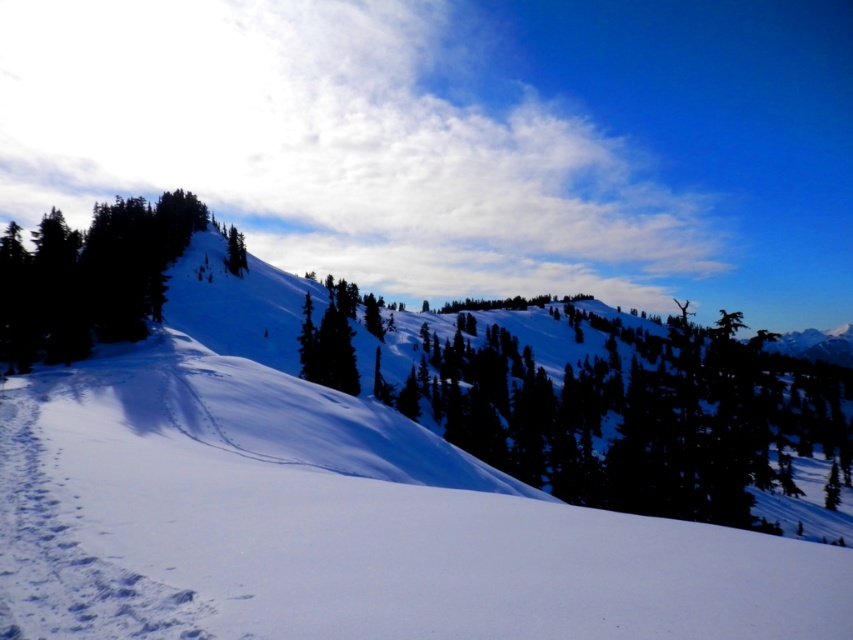
You are standing at the base of the snowy hill and want to reach the top. There are two marked points on the slope, one at point (x=351, y=388) and the other at point (x=236, y=230). Which point should you aim for if you want to take the path that is closer to you?

You should aim for point (x=351, y=388) because it is closer to the viewer than point (x=236, y=230).

You are planning to build a snowman using the white powdery snow at center and the green matte tree at upper center. Which object would you choose for the base of the snowman and why?

You should choose the white powdery snow at center for the base of the snowman because it has a greater height compared to the green matte tree at upper center, providing a more stable foundation.

You are standing at the base of the slope in the winter landscape. You notice two green matte trees, one at the upper left and one at the center. If you want to walk directly from the base of the slope to the green matte tree at center, will you pass by the green matte tree at upper left on your way?

The green matte tree at upper left is 32.99 meters away from the green matte tree at center. Since you are starting at the base of the slope, walking directly to the green matte tree at center would not pass by the green matte tree at upper left because they are positioned at different locations along the slope.